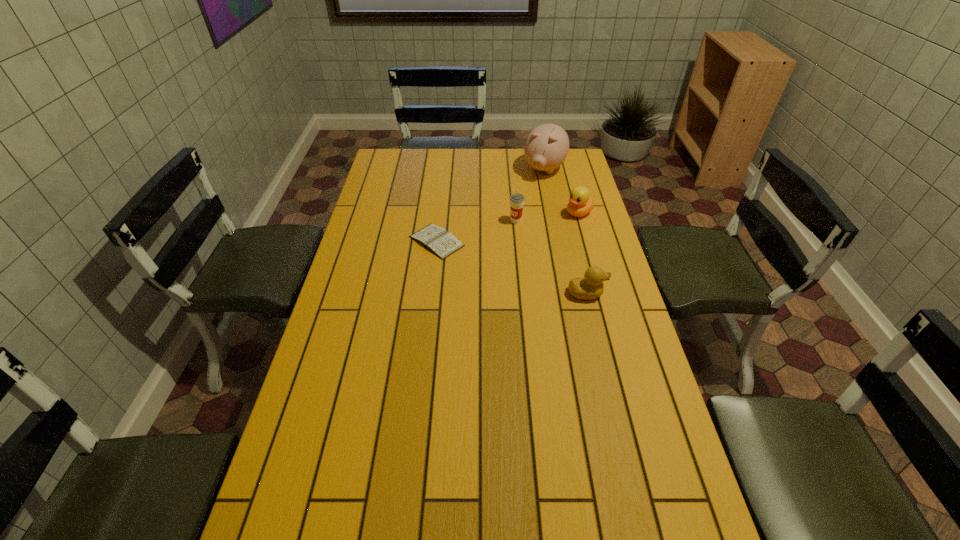
At what (x,y) coordinates should I click in order to perform the action: click on the leftmost object. Please return your answer as a coordinate pair (x, y). This screenshot has height=540, width=960. Looking at the image, I should click on (442, 243).

Where is `diary`? Image resolution: width=960 pixels, height=540 pixels. diary is located at coordinates (442, 243).

The width and height of the screenshot is (960, 540). Find the location of `the nearer duckling`. the nearer duckling is located at coordinates (589, 287).

You are a GUI agent. You are given a task and a screenshot of the screen. Output one action in this format:
    pyautogui.click(x=<x>, y=<y>)
    Task: Click on the cup
    Image resolution: width=960 pixels, height=540 pixels.
    Given the screenshot: What is the action you would take?
    pyautogui.click(x=516, y=200)

The image size is (960, 540). In order to click on the fourth shortest object in this screenshot , I will do `click(516, 200)`.

Identify the location of the farther duckling. This screenshot has width=960, height=540. (580, 203).

The height and width of the screenshot is (540, 960). I want to click on the farthest object, so [546, 147].

Locate an element on the screen. The width and height of the screenshot is (960, 540). piggy bank is located at coordinates (546, 147).

Locate an element on the screen. vacant area located 0.230m on the front of the leftmost object is located at coordinates (429, 311).

Locate an element on the screen. Image resolution: width=960 pixels, height=540 pixels. vacant space situated 0.170m on the side of the second object from left to right with the logo is located at coordinates (495, 253).